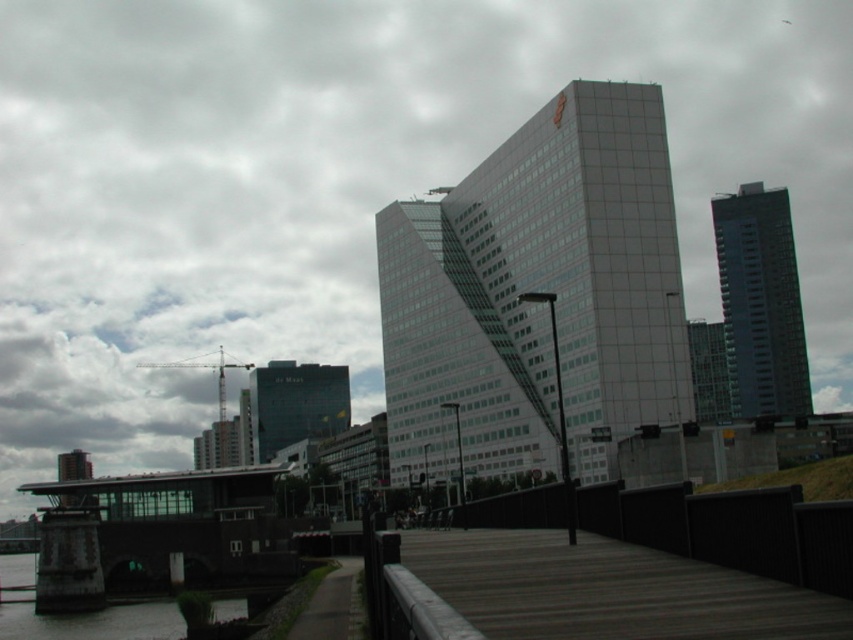
Can you confirm if wooden dock at center is shorter than dark glass building at center?

Yes, wooden dock at center is shorter than dark glass building at center.

Which is in front, point (428, 554) or point (251, 410)?

Point (428, 554) is more forward.

Between point (437, 550) and point (259, 396), which one is positioned behind?

The point (259, 396) is behind.

I want to click on wooden dock at center, so click(608, 589).

You are a GUI agent. You are given a task and a screenshot of the screen. Output one action in this format:
    pyautogui.click(x=<x>, y=<y>)
    Task: Click on the glassy gray skyscraper at center
    The width and height of the screenshot is (853, 640).
    Given the screenshot: What is the action you would take?
    pyautogui.click(x=538, y=289)

Does glassy gray skyscraper at center come in front of dark gray asphalt path at lower left?

No, it is behind dark gray asphalt path at lower left.

Between point (640, 422) and point (334, 632), which one is positioned behind?

Positioned behind is point (640, 422).

Where is `glassy gray skyscraper at center`? This screenshot has height=640, width=853. glassy gray skyscraper at center is located at coordinates (538, 289).

You are a GUI agent. You are given a task and a screenshot of the screen. Output one action in this format:
    pyautogui.click(x=<x>, y=<y>)
    Task: Click on the glassy gray skyscraper at center
    The height and width of the screenshot is (640, 853).
    Given the screenshot: What is the action you would take?
    pyautogui.click(x=538, y=289)

Which is more to the left, glassy gray skyscraper at center or wooden dock at center?

From the viewer's perspective, wooden dock at center appears more on the left side.

Is point (573, 161) farther from camera compared to point (816, 624)?

Yes.

Locate an element on the screen. The image size is (853, 640). glassy gray skyscraper at center is located at coordinates (538, 289).